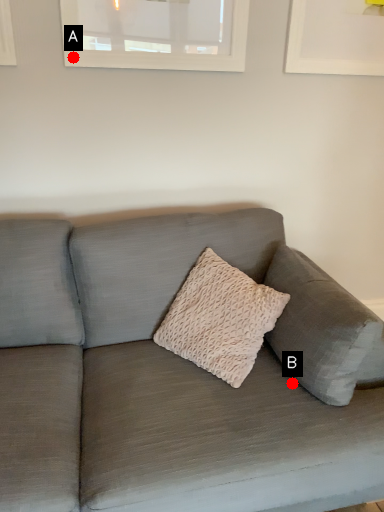
Question: Two points are circled on the image, labeled by A and B beside each circle. Among these points, which one is farthest from the camera?

Choices:
 (A) A is further
 (B) B is further

Answer: (A)